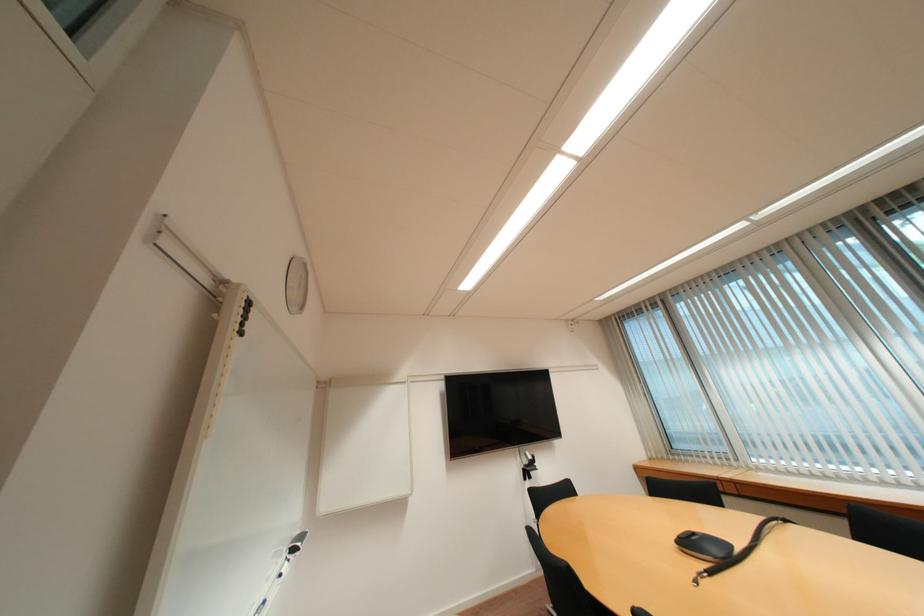
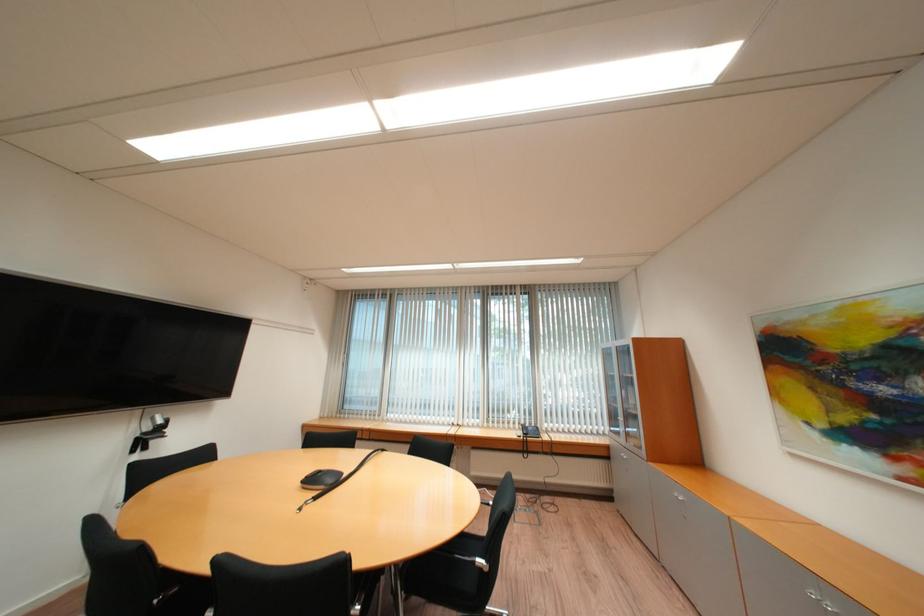
The point at (533, 456) is marked in the first image. Where is the corresponding point in the second image?

(162, 419)